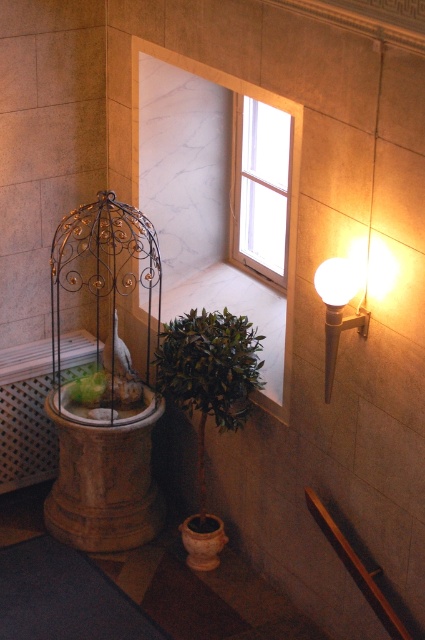
Question: Does clear glass window at upper center appear on the right side of matte glass globe at upper right?

Choices:
 (A) no
 (B) yes

Answer: (A)

Question: Among these points, which one is nearest to the camera?

Choices:
 (A) (91, 385)
 (B) (71, 440)
 (C) (320, 292)

Answer: (C)

Question: Is green leafy plant at lower center closer to the viewer compared to green leafy plant at center?

Choices:
 (A) yes
 (B) no

Answer: (A)

Question: Can you confirm if gold wire birdcage at left is positioned above green leafy plant at lower center?

Choices:
 (A) no
 (B) yes

Answer: (B)

Question: Based on their relative distances, which object is nearer to the gold wire birdcage at left?

Choices:
 (A) green leafy plant at lower center
 (B) green leafy plant at center
 (C) matte glass globe at upper right

Answer: (B)

Question: Which object appears closest to the camera in this image?

Choices:
 (A) white frosted glass light fixture at upper right
 (B) clear glass window at upper center
 (C) matte glass globe at upper right

Answer: (A)